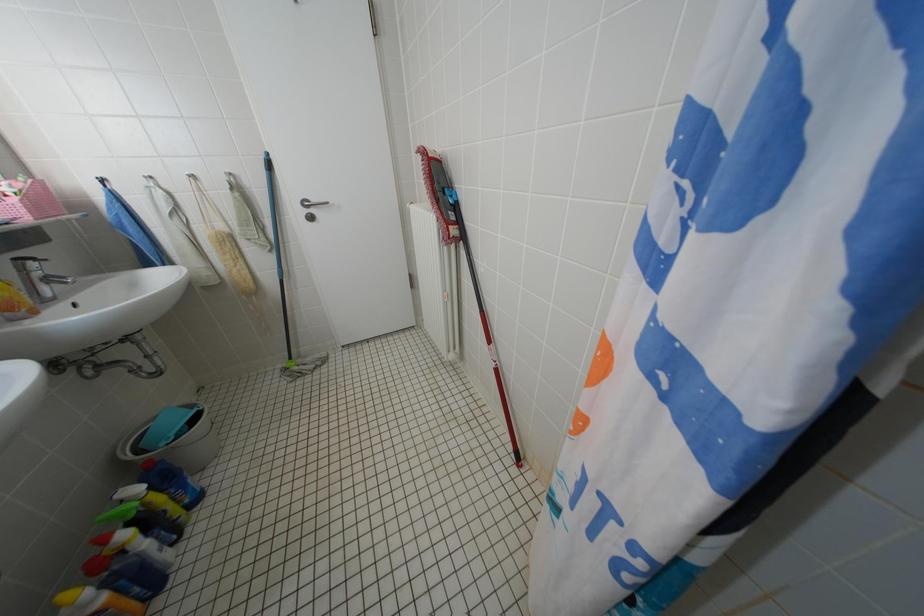
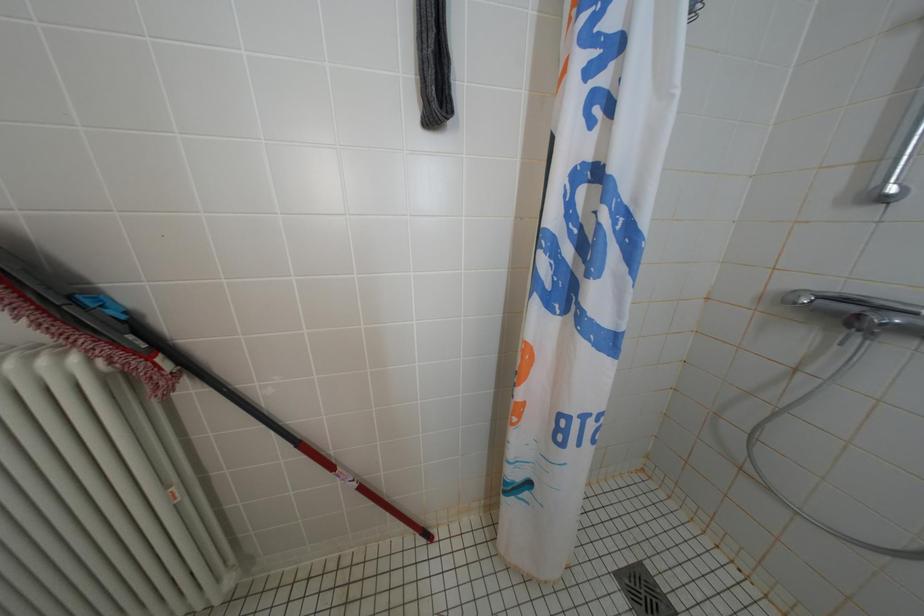
Question: The camera is either moving clockwise (left) or counter-clockwise (right) around the object. The first image is from the beginning of the video and the second image is from the end. Is the camera moving left or right when shooting the video?

Choices:
 (A) Left
 (B) Right

Answer: (A)